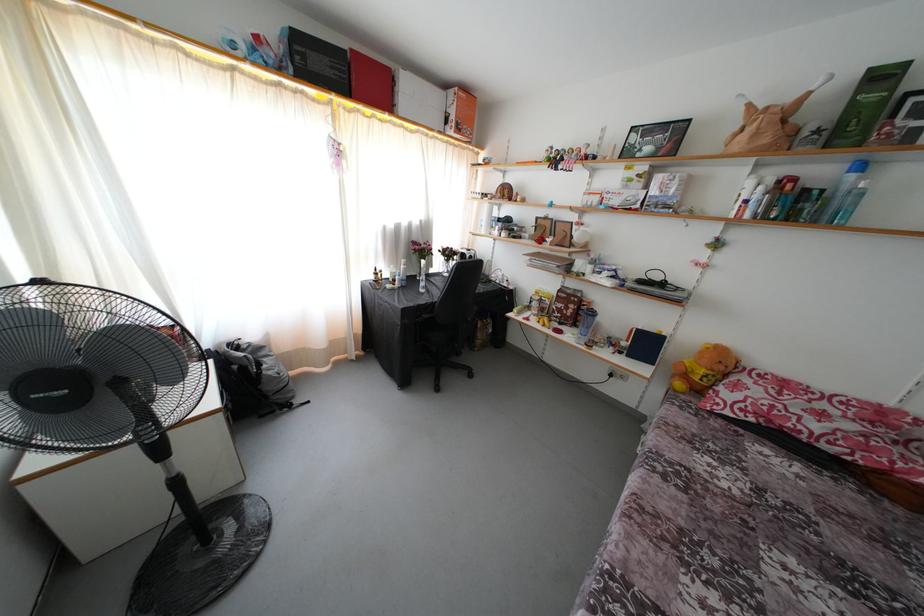
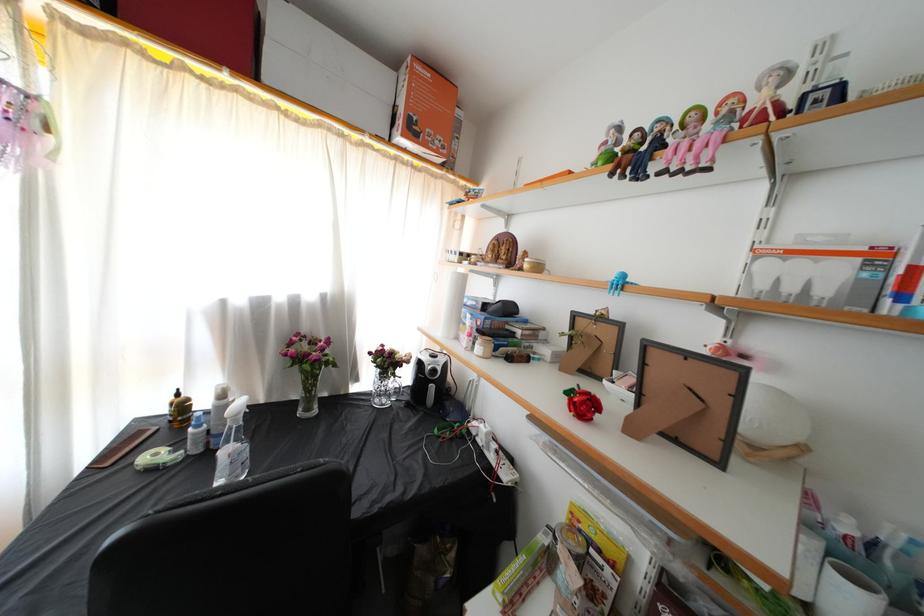
The point at (377, 283) is marked in the first image. Where is the corresponding point in the second image?

(171, 416)